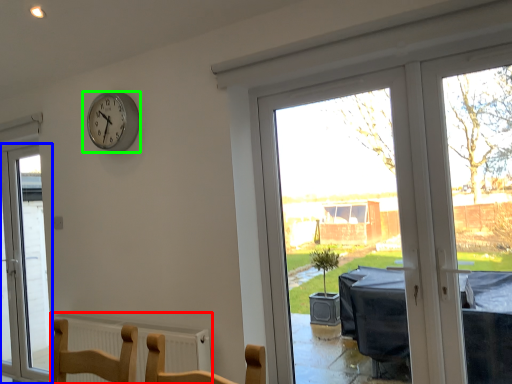
Question: Estimate the real-world distances between objects in this image. Which object is farther from radiator (highlighted by a red box), window (highlighted by a blue box) or wall clock (highlighted by a green box)?

Choices:
 (A) window
 (B) wall clock

Answer: (A)